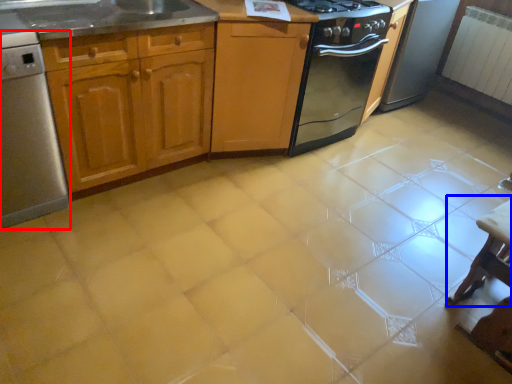
Question: Which object appears farthest to the camera in this image, home appliance (highlighted by a red box) or table (highlighted by a blue box)?

Choices:
 (A) home appliance
 (B) table

Answer: (B)